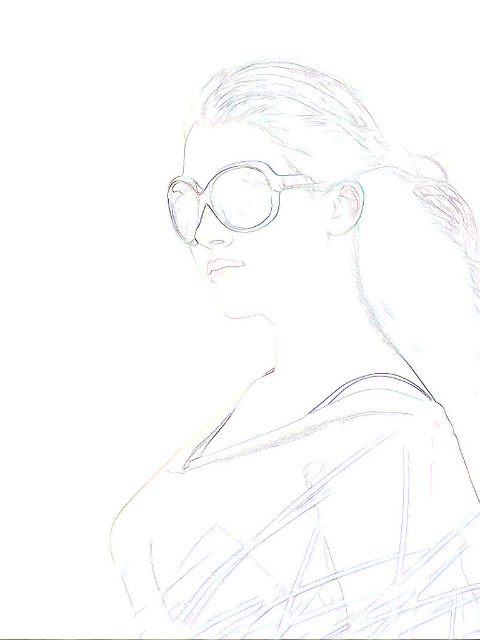
You are an artist trying to draw the person in the image. You want to make sure that the two points, point (x=351, y=484) and point (x=190, y=244), are correctly positioned in terms of depth. Which of these two points should appear closer to the viewer?

Point (x=351, y=484) is closer to the viewer than point (x=190, y=244) according to the description.

You are standing in front of an artwork displaying a person wearing matte plastic glasses at center. If you want to touch the glasses without moving closer, can you reach them with your outstretched hand? Assume your arm can extend 60 centimeters.

The matte plastic glasses at center are 65.03 centimeters away from the viewer. Since your arm can only extend 60 centimeters, you cannot reach them without moving closer.

You are an optometrist examining a patient. You notice two pairs of glasses on the desk in front of you. The patient asks which pair is closer to them. The glasses are labeled as matte plastic glasses at center and clear plastic glasses at center. Based on the image, which pair is closer to the patient?

The matte plastic glasses at center are closer to the patient because they are positioned closer to the viewer than the clear plastic glasses at center.